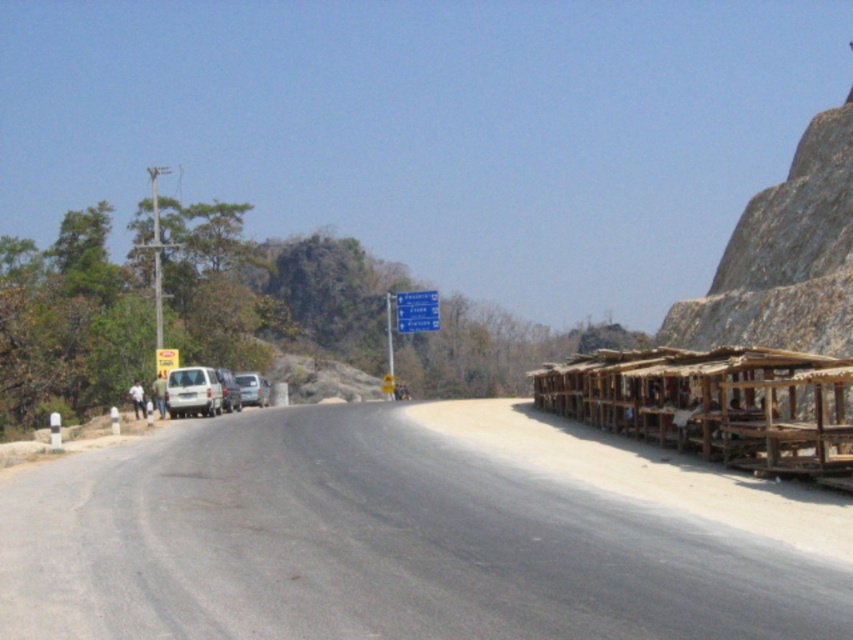
Question: Where is smooth asphalt road at center located in relation to white matte van at center in the image?

Choices:
 (A) above
 (B) below

Answer: (B)

Question: Does white matte van at left appear on the right side of white matte van at center?

Choices:
 (A) no
 (B) yes

Answer: (B)

Question: Can you confirm if smooth asphalt road at center is positioned below silver metallic car at center?

Choices:
 (A) no
 (B) yes

Answer: (A)

Question: Which object appears farthest from the camera in this image?

Choices:
 (A) white matte van at center
 (B) white matte van at left

Answer: (A)

Question: Which object is positioned closest to the brown wooden shelter at right?

Choices:
 (A) smooth asphalt road at center
 (B) white matte van at center

Answer: (A)

Question: Which object is closer to the camera taking this photo?

Choices:
 (A) white matte van at center
 (B) silver metallic car at center
 (C) smooth asphalt road at center
 (D) brown wooden shelter at right

Answer: (C)